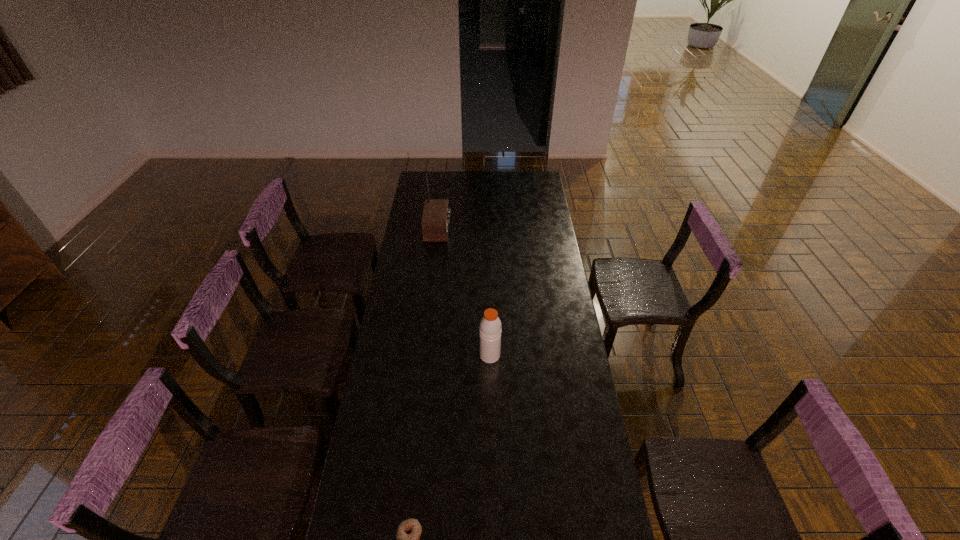
The height and width of the screenshot is (540, 960). Find the location of `the farthest object`. the farthest object is located at coordinates 435,219.

What are the coordinates of `the rightmost object` in the screenshot? It's located at (490, 327).

This screenshot has height=540, width=960. Identify the location of the second tallest object. (490, 327).

Find the location of a particular element. This screenshot has height=540, width=960. blank area located on the front-facing side of the radio receiver is located at coordinates (472, 230).

This screenshot has width=960, height=540. In order to click on vacant space located on the left of the rightmost object in this screenshot , I will do `click(445, 355)`.

This screenshot has width=960, height=540. In order to click on object situated at the left edge in this screenshot , I will do click(x=435, y=219).

Image resolution: width=960 pixels, height=540 pixels. Identify the location of free space at the far edge of the desktop. [x=459, y=180].

This screenshot has height=540, width=960. I want to click on vacant space at the left edge of the desktop, so click(384, 438).

This screenshot has width=960, height=540. In order to click on vacant space at the right edge in this screenshot , I will do `click(546, 230)`.

This screenshot has height=540, width=960. Find the location of `vacant point at the far right corner`. vacant point at the far right corner is located at coordinates (534, 182).